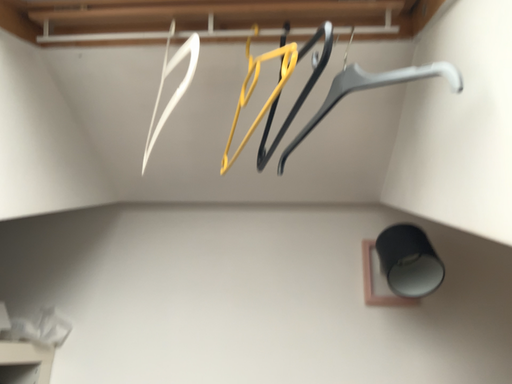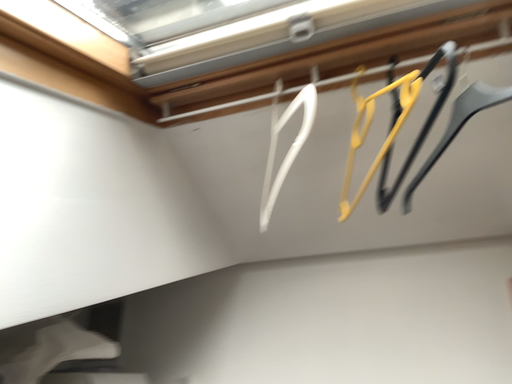
Question: Which way did the camera rotate in the video?

Choices:
 (A) rotated right
 (B) rotated left

Answer: (B)